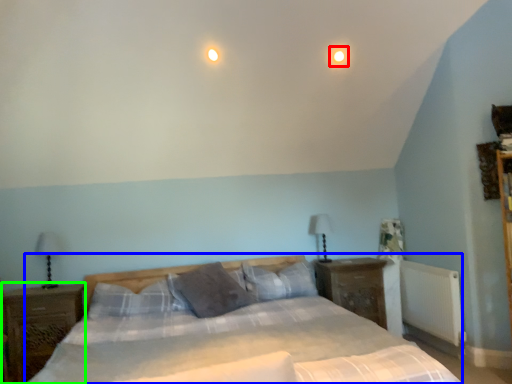
Question: Which object is positioned closest to light (highlighted by a red box)? Select from bed (highlighted by a blue box) and nightstand (highlighted by a green box).

Choices:
 (A) bed
 (B) nightstand

Answer: (A)